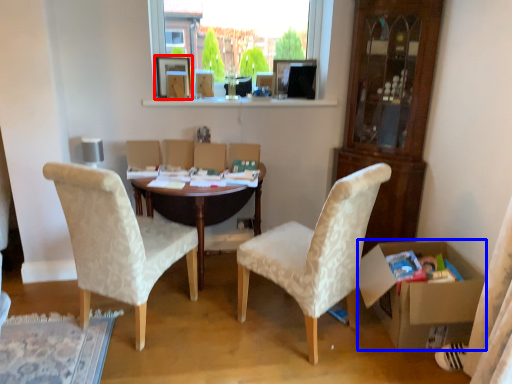
Question: Which object is further to the camera taking this photo, picture frame (highlighted by a red box) or box (highlighted by a blue box)?

Choices:
 (A) picture frame
 (B) box

Answer: (A)